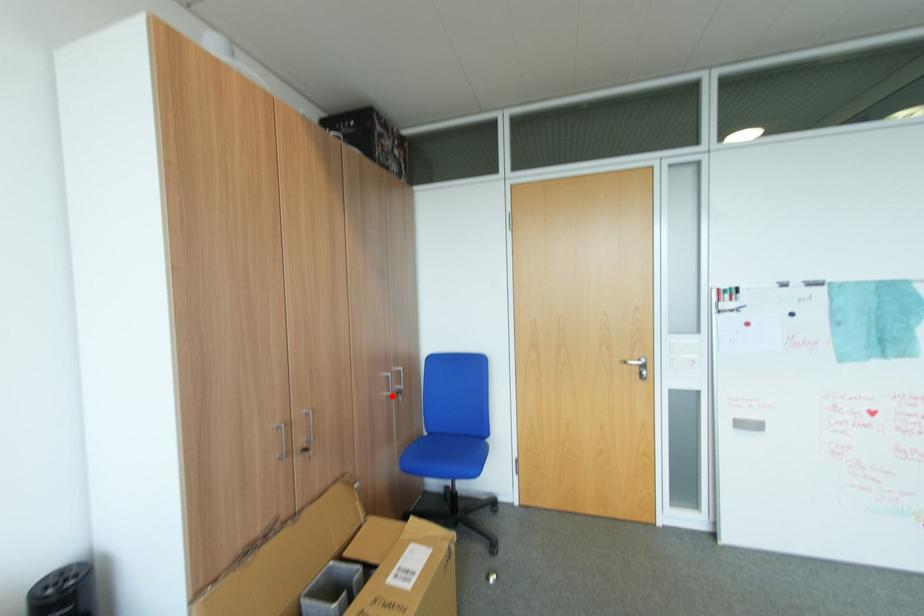
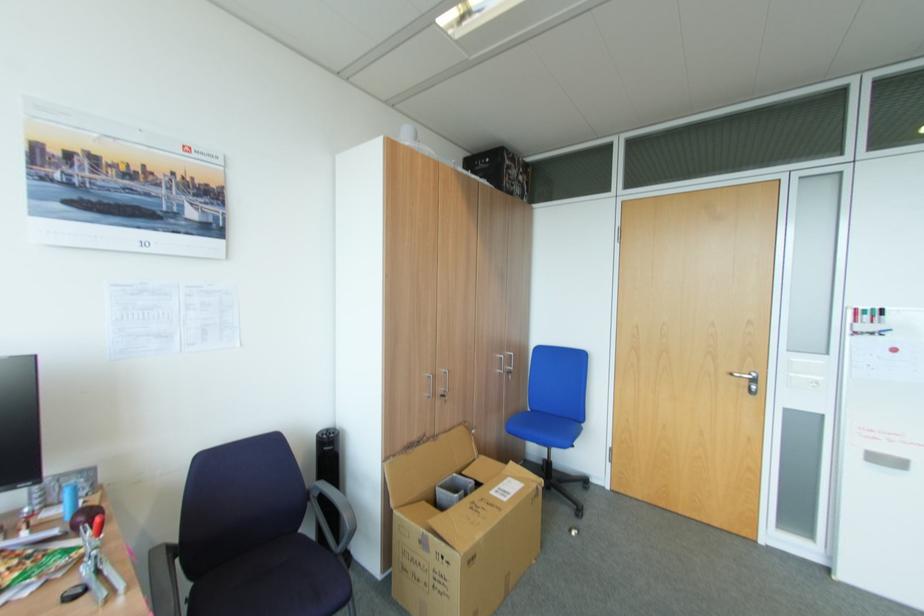
In the second image, find the point that corresponds to the highlighted location in the first image.

(505, 371)